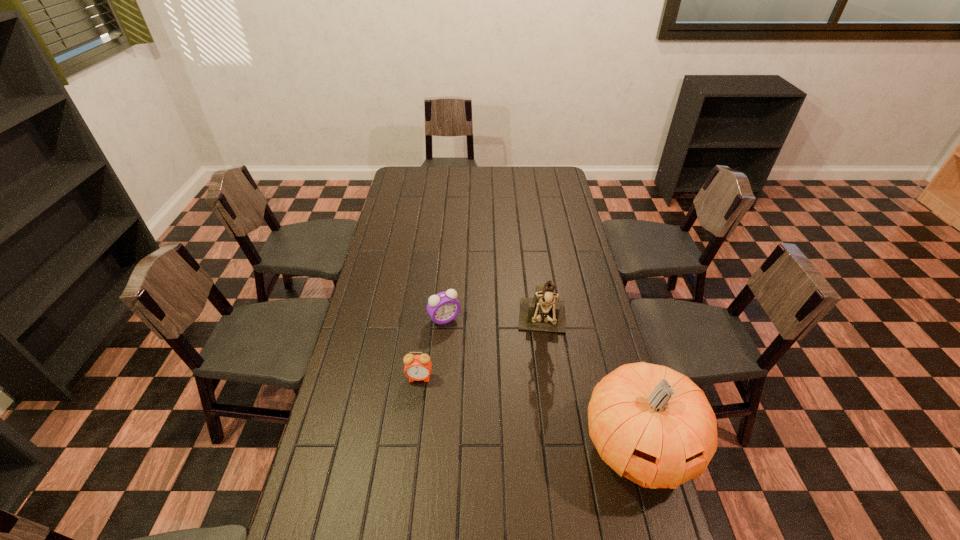
Identify the location of free space on the desktop that is between the third farthest object and the nearest object and is positioned on the face of the farther alarm clock. (499, 403).

Identify the location of vacant space on the desktop that is between the nearer alarm clock and the pumpkin and is positioned on the front-facing side of the figurine. Image resolution: width=960 pixels, height=540 pixels. (542, 416).